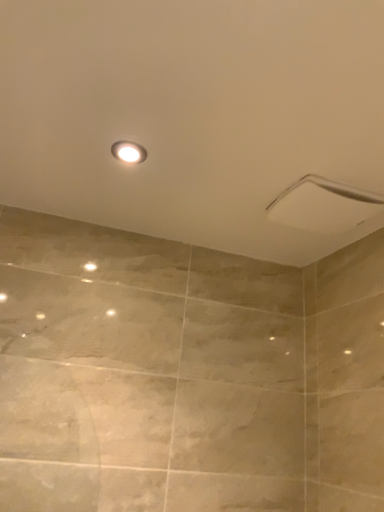
Question: Considering the relative sizes of white glossy light fixture at upper center and white glossy shower head at upper right in the image provided, is white glossy light fixture at upper center taller than white glossy shower head at upper right?

Choices:
 (A) no
 (B) yes

Answer: (A)

Question: Considering the relative sizes of white glossy light fixture at upper center and white glossy shower head at upper right in the image provided, is white glossy light fixture at upper center wider than white glossy shower head at upper right?

Choices:
 (A) no
 (B) yes

Answer: (A)

Question: From a real-world perspective, is white glossy light fixture at upper center on top of white glossy shower head at upper right?

Choices:
 (A) no
 (B) yes

Answer: (B)

Question: From a real-world perspective, is white glossy light fixture at upper center below white glossy shower head at upper right?

Choices:
 (A) yes
 (B) no

Answer: (B)

Question: Does white glossy light fixture at upper center lie in front of white glossy shower head at upper right?

Choices:
 (A) no
 (B) yes

Answer: (B)

Question: Would you say white glossy light fixture at upper center is outside white glossy shower head at upper right?

Choices:
 (A) yes
 (B) no

Answer: (A)

Question: Is white glossy shower head at upper right thinner than white glossy light fixture at upper center?

Choices:
 (A) yes
 (B) no

Answer: (B)

Question: Is white glossy shower head at upper right positioned beyond the bounds of white glossy light fixture at upper center?

Choices:
 (A) no
 (B) yes

Answer: (B)

Question: Considering the relative sizes of white glossy shower head at upper right and white glossy light fixture at upper center in the image provided, is white glossy shower head at upper right shorter than white glossy light fixture at upper center?

Choices:
 (A) yes
 (B) no

Answer: (B)

Question: Is white glossy shower head at upper right bigger than white glossy light fixture at upper center?

Choices:
 (A) no
 (B) yes

Answer: (B)

Question: Is white glossy shower head at upper right looking in the opposite direction of white glossy light fixture at upper center?

Choices:
 (A) no
 (B) yes

Answer: (A)

Question: Is there a large distance between white glossy shower head at upper right and white glossy light fixture at upper center?

Choices:
 (A) yes
 (B) no

Answer: (B)

Question: Is white glossy shower head at upper right in front of or behind white glossy light fixture at upper center in the image?

Choices:
 (A) behind
 (B) front

Answer: (A)